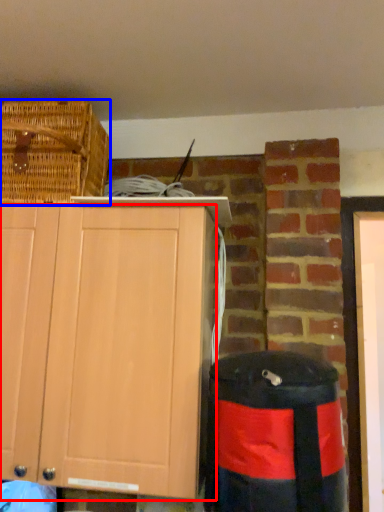
Question: Which object appears closest to the camera in this image, cabinetry (highlighted by a red box) or picnic basket (highlighted by a blue box)?

Choices:
 (A) cabinetry
 (B) picnic basket

Answer: (A)